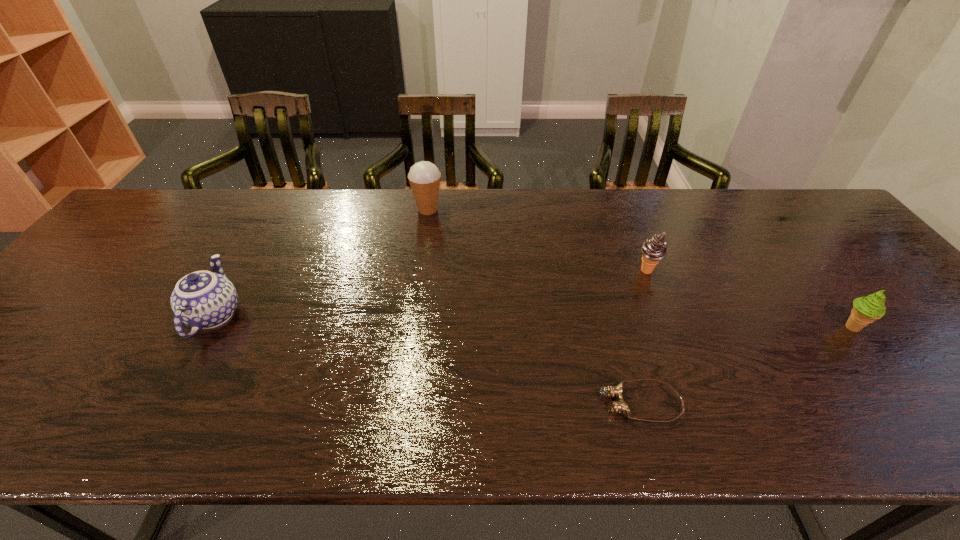
The width and height of the screenshot is (960, 540). Find the location of `unoccupied position between the leftmost object and the second farthest object`. unoccupied position between the leftmost object and the second farthest object is located at coordinates (431, 293).

You are a GUI agent. You are given a task and a screenshot of the screen. Output one action in this format:
    pyautogui.click(x=<x>, y=<y>)
    Task: Click on the blank region between the third object from right to left and the rightmost object
    This screenshot has width=960, height=540.
    Given the screenshot: What is the action you would take?
    pyautogui.click(x=746, y=365)

I want to click on vacant space that's between the rightmost icecream and the chinaware, so click(x=533, y=321).

Image resolution: width=960 pixels, height=540 pixels. I want to click on free space between the fourth object from left to right and the chinaware, so click(431, 293).

What are the coordinates of `empty space that is in between the rightmost icecream and the nearest object` in the screenshot? It's located at (746, 365).

Identify which object is the third closest to the second nearest icecream. Please provide its 2D coordinates. Your answer should be formatted as a tuple, i.e. [(x, y)], where the tuple contains the x and y coordinates of a point satisfying the conditions above.

[(424, 177)]

Locate an element on the screen. The height and width of the screenshot is (540, 960). object that is the fourth nearest to the rightmost object is located at coordinates (202, 300).

Choose which icecream is the nearest neighbor to the rightmost object. Please provide its 2D coordinates. Your answer should be formatted as a tuple, i.e. [(x, y)], where the tuple contains the x and y coordinates of a point satisfying the conditions above.

[(654, 249)]

Choose which icecream is the second nearest neighbor to the shortest object. Please provide its 2D coordinates. Your answer should be formatted as a tuple, i.e. [(x, y)], where the tuple contains the x and y coordinates of a point satisfying the conditions above.

[(866, 310)]

Locate an element on the screen. vacant region that satisfies the following two spatial constraints: 1. at the spout of the chinaware; 2. on the left side of the farthest icecream is located at coordinates (275, 210).